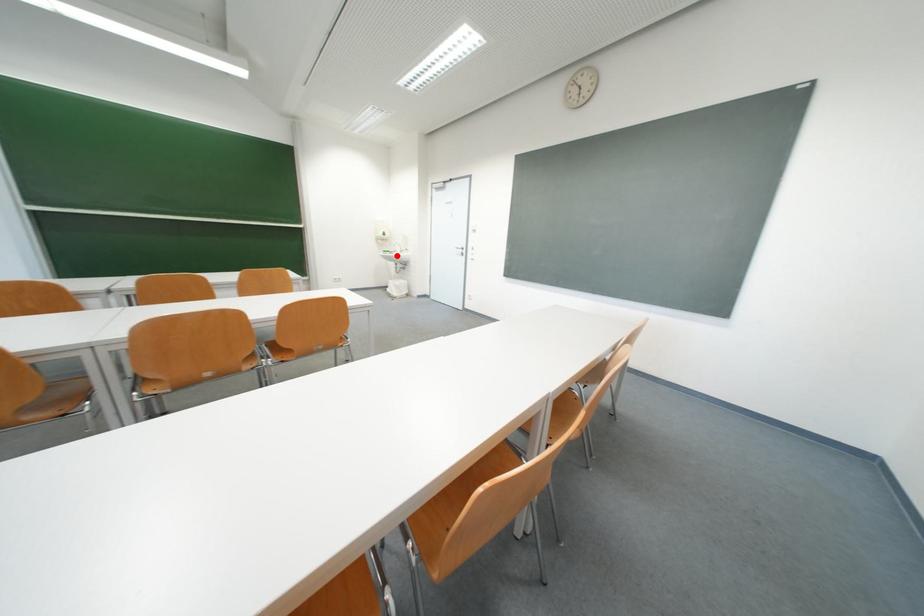
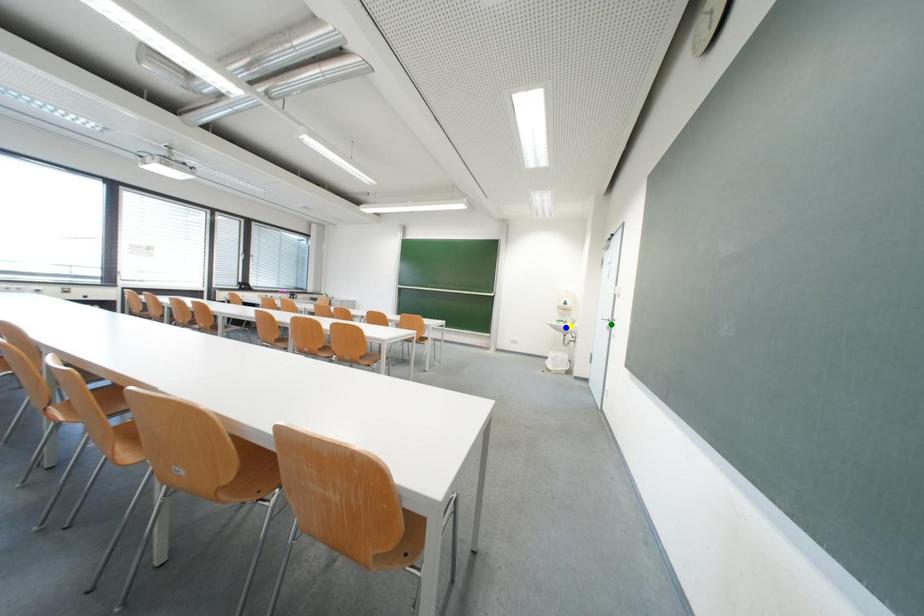
Question: I am providing you with two images of the same scene from different viewpoints. A red point is marked on the first image. You are given multiple points on the second image. Which spot in image 2 lines up with the point in image 1?

Choices:
 (A) yellow point
 (B) green point
 (C) blue point

Answer: (A)